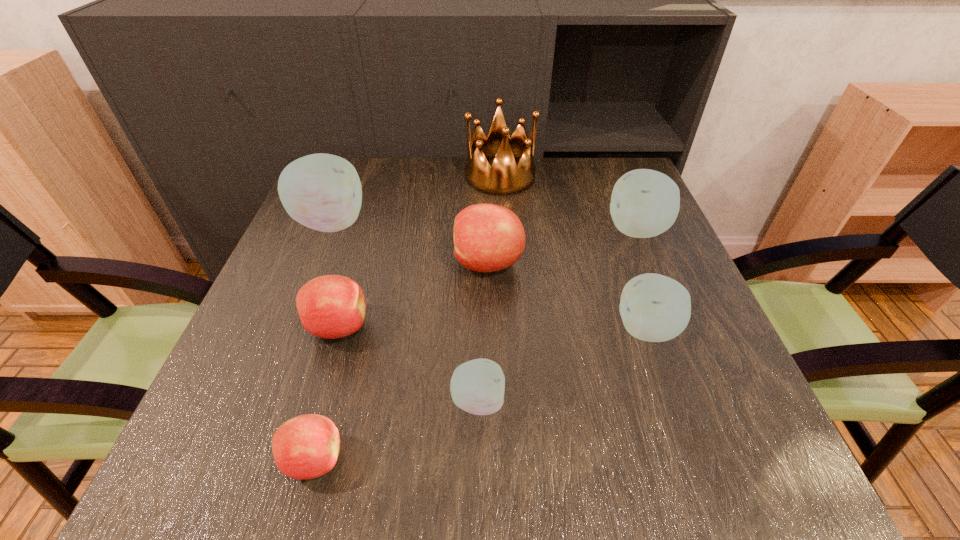
Where is `the nearest object`? the nearest object is located at coordinates (305, 447).

At what (x,y) coordinates should I click in order to perform the action: click on the smallest red apple. Please return your answer as a coordinate pair (x, y). Looking at the image, I should click on (305, 447).

Identify the location of vacant region located 0.050m on the front of the farthest object. (502, 207).

Image resolution: width=960 pixels, height=540 pixels. In order to click on vacant area situated 0.320m on the right of the biggest white apple in this screenshot , I will do `click(497, 223)`.

The width and height of the screenshot is (960, 540). I want to click on vacant space located 0.070m on the left of the third smallest white apple, so click(578, 230).

Where is `vacant region located on the front of the farthest red apple`? This screenshot has width=960, height=540. vacant region located on the front of the farthest red apple is located at coordinates (491, 367).

Where is `free space located on the front of the third biggest white apple`? free space located on the front of the third biggest white apple is located at coordinates (703, 488).

Find the location of a particular element. vacant area located 0.380m on the back of the second farthest red apple is located at coordinates (376, 197).

The height and width of the screenshot is (540, 960). I want to click on vacant space located on the back of the second nearest object, so click(478, 238).

Where is `vacant space situated on the back of the nearest apple`? The width and height of the screenshot is (960, 540). vacant space situated on the back of the nearest apple is located at coordinates (337, 372).